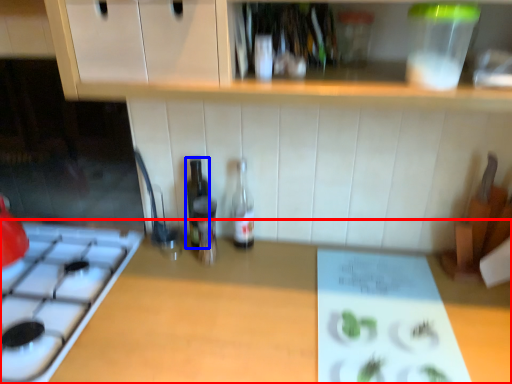
Question: Among these objects, which one is nearest to the camera, countertop (highlighted by a red box) or bottle (highlighted by a blue box)?

Choices:
 (A) countertop
 (B) bottle

Answer: (A)